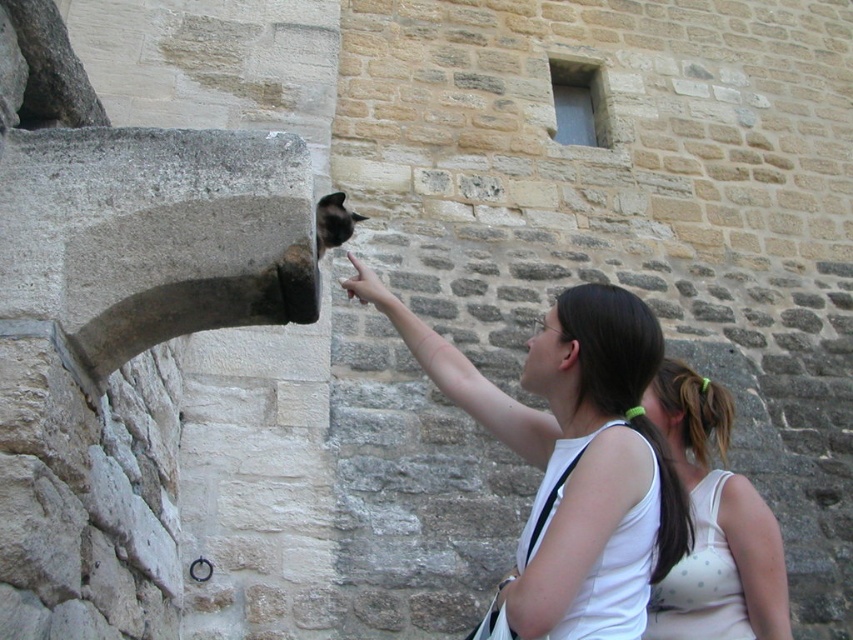
Between white tank top at center and white polka dot tank top at lower right, which one has more height?

white tank top at center

Between white tank top at center and white polka dot tank top at lower right, which one appears on the left side from the viewer's perspective?

white tank top at center is more to the left.

Is point (643, 307) less distant than point (670, 614)?

Yes, it is.

Locate an element on the screen. The height and width of the screenshot is (640, 853). white tank top at center is located at coordinates (566, 433).